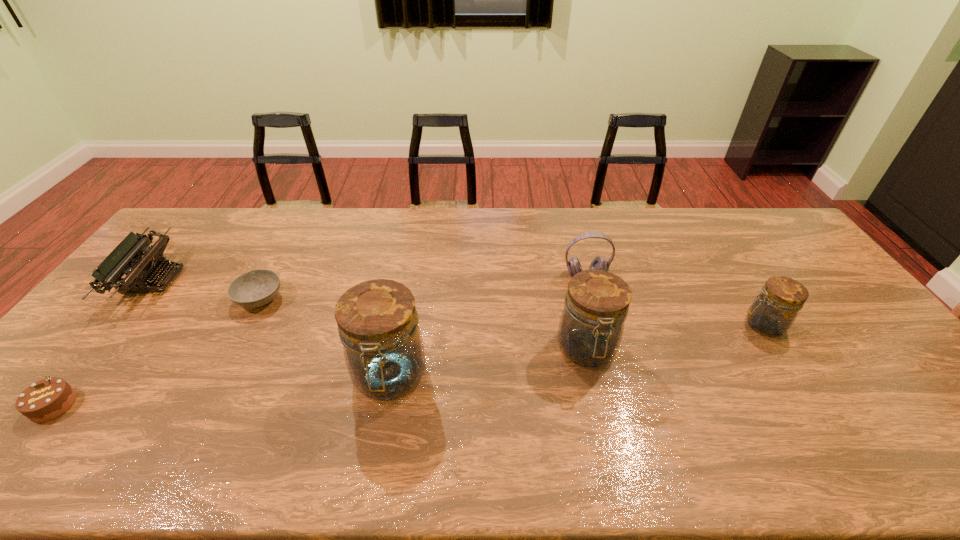
Identify the location of the fourth object from left to right. (378, 324).

What are the coordinates of `the second tallest jar` in the screenshot? It's located at (591, 325).

Where is `the second jar from left to right`? The image size is (960, 540). the second jar from left to right is located at coordinates (591, 325).

Identify the location of the rightmost object. (772, 313).

Where is `the shortest jar`? Image resolution: width=960 pixels, height=540 pixels. the shortest jar is located at coordinates (772, 313).

Where is `bowl`? This screenshot has width=960, height=540. bowl is located at coordinates (255, 288).

This screenshot has width=960, height=540. What are the coordinates of `the third object from left to right` in the screenshot? It's located at (255, 288).

Find the location of `headset`. headset is located at coordinates (599, 263).

At what (x,y) coordinates should I click in order to perform the action: click on typewriter. Please return your answer as a coordinate pair (x, y). The height and width of the screenshot is (540, 960). Looking at the image, I should click on (126, 258).

Where is `chocolate cake`? This screenshot has width=960, height=540. chocolate cake is located at coordinates (47, 399).